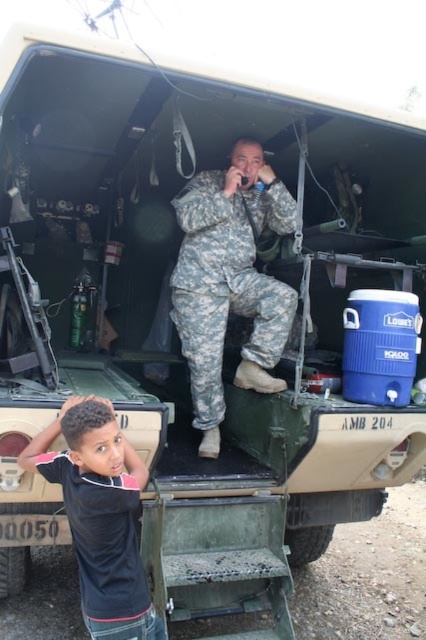
You are a military observer analyzing the scene. You notice the camouflage fabric uniform at center and the black matte shirt at lower left. Which individual is taller?

The camouflage fabric uniform at center is taller than the black matte shirt at lower left.

You are a military medic with a first aid kit that is 3 feet long. You need to move from the camouflage fabric uniform at center to the black matte shirt at lower left. Can your kit fit between them without bending?

The distance between the camouflage fabric uniform at center and the black matte shirt at lower left is 3.65 feet. Since the first aid kit is 3 feet long, it can fit between them without bending.